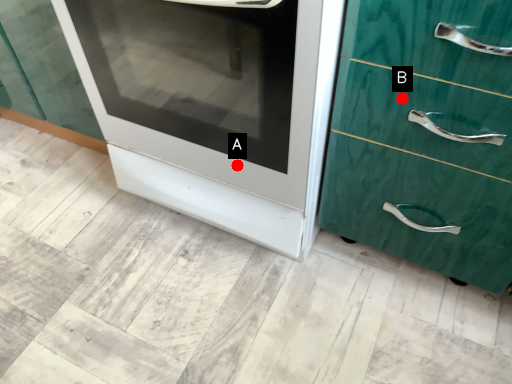
Question: Two points are circled on the image, labeled by A and B beside each circle. Which of the following is the closest to the observer?

Choices:
 (A) A is closer
 (B) B is closer

Answer: (B)